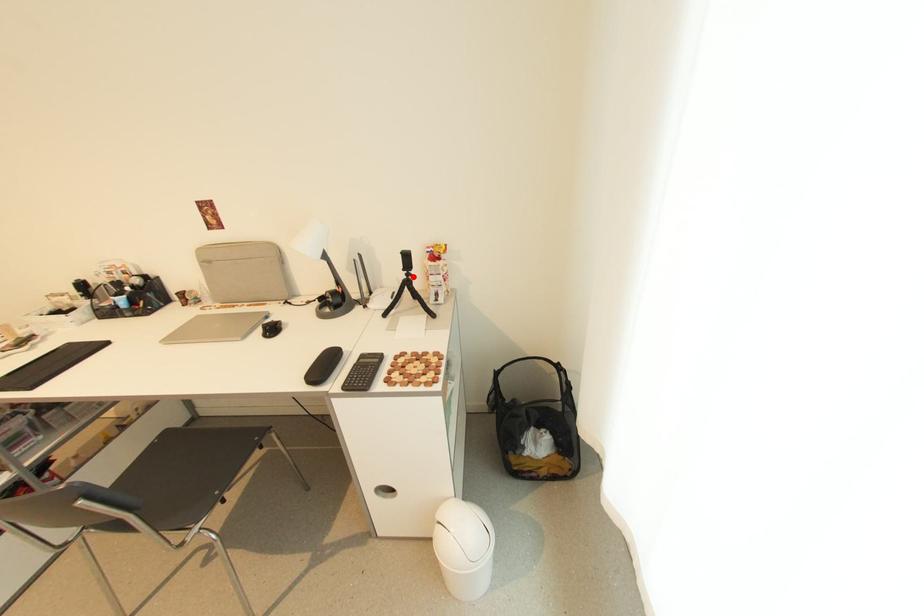
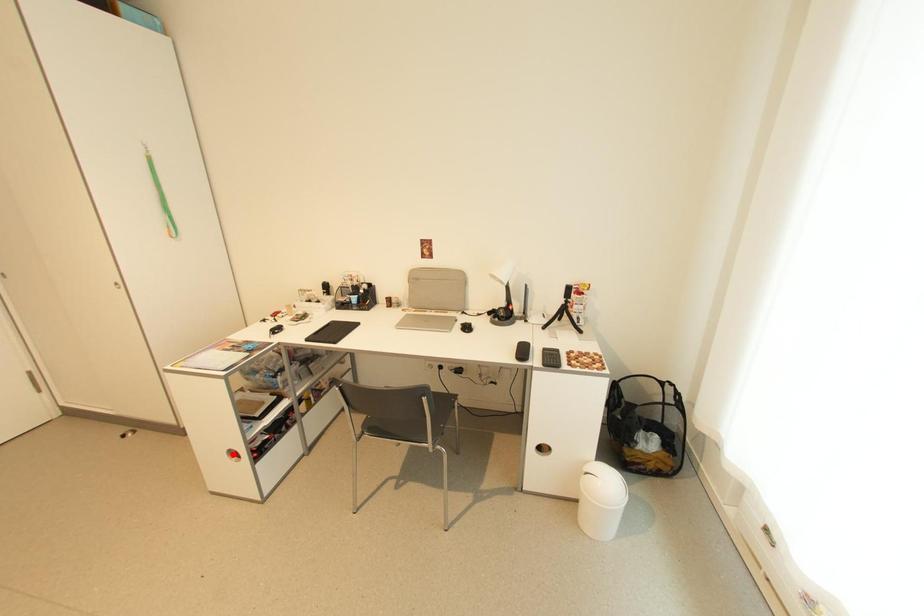
I am providing you with two images of the same scene from different viewpoints. A red point is marked on the first image and another point is marked on the second image. Do the highlighted points in image1 and image2 indicate the same real-world spot?

No